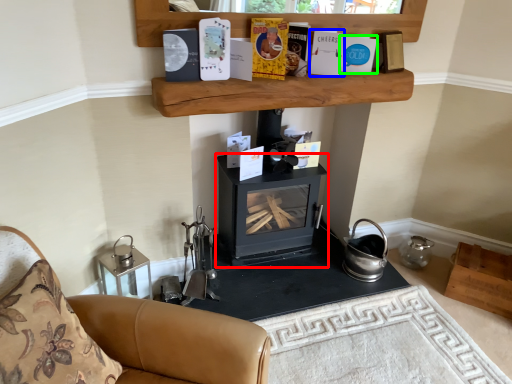
Question: Based on their relative distances, which object is nearer to wood burning stove (highlighted by a red box)? Choose from paperback book (highlighted by a blue box) and paperback book (highlighted by a green box).

Choices:
 (A) paperback book
 (B) paperback book

Answer: (A)